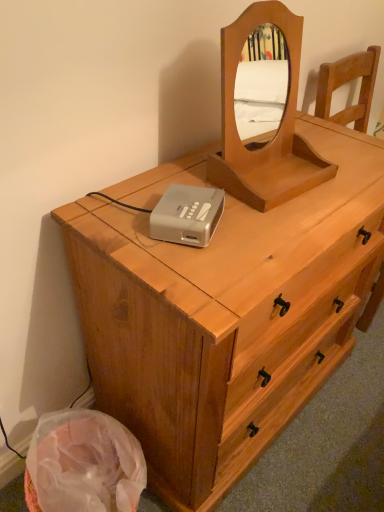
The width and height of the screenshot is (384, 512). Identify the location of vacant space to the left of silver plastic cassette at center. 113,216.